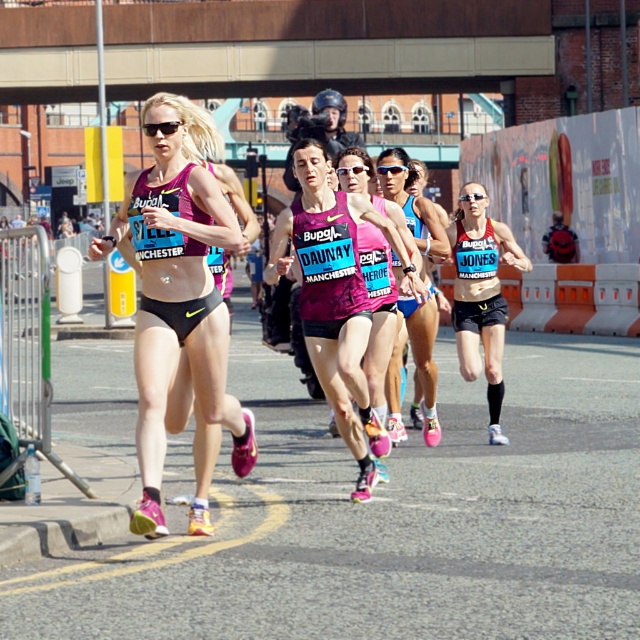
You are a photographer positioned at the starting line of the marathon. You want to capture both the black matte bikini top at center and the pink fabric tank top at center in a single shot. Which clothing item will appear closer to the camera in the photo?

The black matte bikini top at center will appear closer to the camera because it is positioned further to the viewer than the pink fabric tank top at center.

You are a photographer positioned at the starting line of the marathon. You want to capture a closeup shot of the black matte bikini top at center worn by a runner who is currently 13.20 meters away. Your camera has a maximum zoom range of 12 meters. Can you take the closeup shot without moving from your current position?

The black matte bikini top at center is 13.20 meters away from the camera. Since the camera can only zoom up to 12 meters, the photographer cannot take the closeup shot without moving closer.